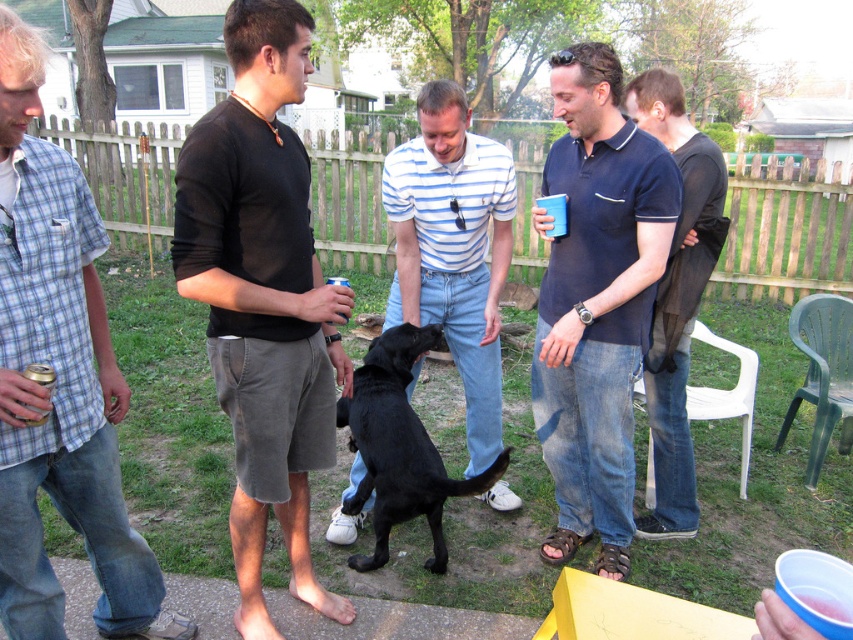
Is light blue plaid shirt at left to the left of navy blue polo shirt at center from the viewer's perspective?

Yes, light blue plaid shirt at left is to the left of navy blue polo shirt at center.

Between light blue plaid shirt at left and navy blue polo shirt at center, which one appears on the right side from the viewer's perspective?

navy blue polo shirt at center

Locate an element on the screen. The height and width of the screenshot is (640, 853). light blue plaid shirt at left is located at coordinates (59, 380).

In order to click on light blue plaid shirt at left in this screenshot , I will do `click(59, 380)`.

Is point (494, 483) less distant than point (346, 284)?

That is False.

Between point (401, 173) and point (340, 278), which one is positioned in front?

Positioned in front is point (340, 278).

The width and height of the screenshot is (853, 640). What are the coordinates of `smooth black dog at center` in the screenshot? It's located at (453, 248).

The height and width of the screenshot is (640, 853). I want to click on navy blue polo shirt at center, so click(x=596, y=300).

Who is lower down, navy blue polo shirt at center or blue plastic cup at center?

navy blue polo shirt at center is below.

Image resolution: width=853 pixels, height=640 pixels. What do you see at coordinates (596, 300) in the screenshot?
I see `navy blue polo shirt at center` at bounding box center [596, 300].

The image size is (853, 640). In order to click on navy blue polo shirt at center in this screenshot , I will do `click(596, 300)`.